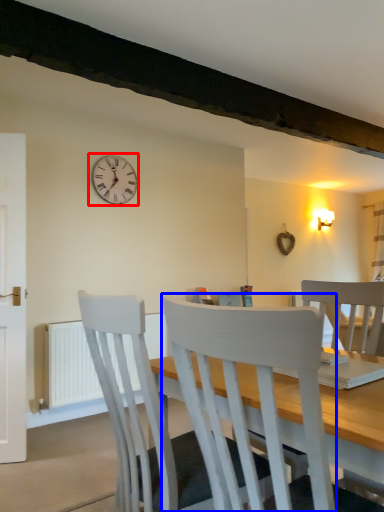
Question: Which of the following is the closest to the observer, wall clock (highlighted by a red box) or chair (highlighted by a blue box)?

Choices:
 (A) wall clock
 (B) chair

Answer: (B)